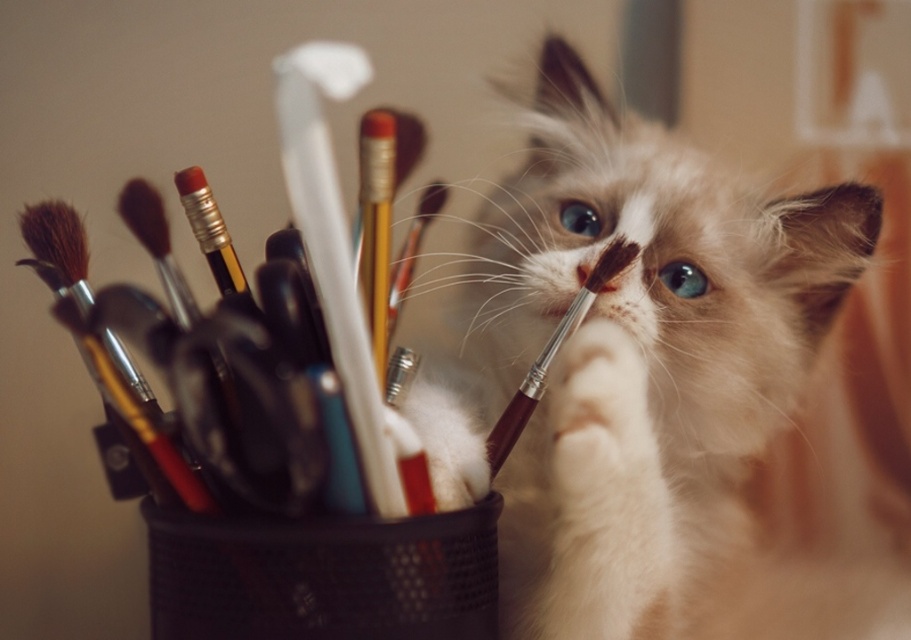
Is white fluffy cat at center below brown wooden paint brush at center?

Actually, white fluffy cat at center is above brown wooden paint brush at center.

Does white fluffy cat at center have a lesser width compared to brown wooden paint brush at center?

No, white fluffy cat at center is not thinner than brown wooden paint brush at center.

Does point (454, 307) come in front of point (509, 436)?

No, it is behind (509, 436).

Where is `white fluffy cat at center`? The height and width of the screenshot is (640, 911). white fluffy cat at center is located at coordinates (643, 384).